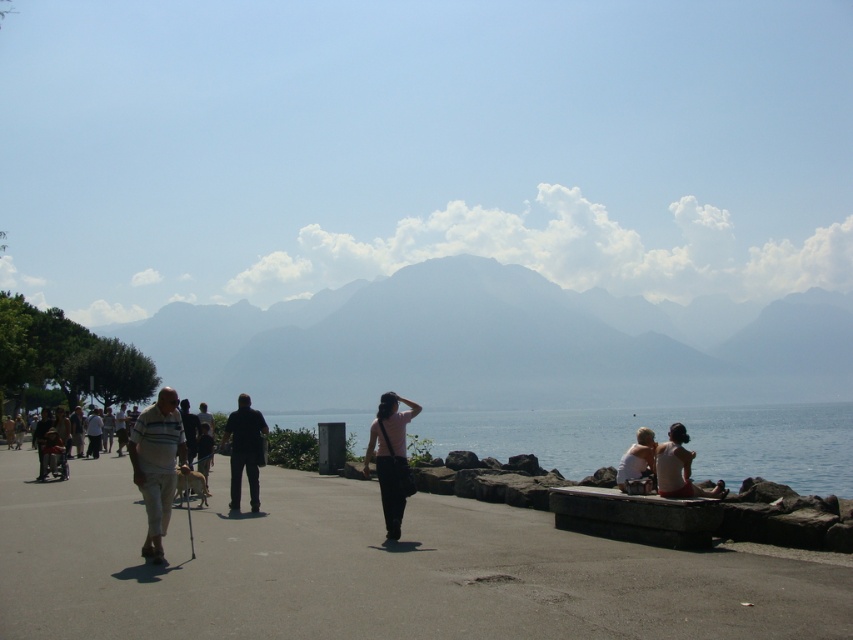
Question: Does concrete sidewalk at center have a smaller size compared to striped cotton shirt at left?

Choices:
 (A) no
 (B) yes

Answer: (A)

Question: Which of the following is the farthest from the observer?

Choices:
 (A) (653, 433)
 (B) (206, 616)

Answer: (A)

Question: Does concrete sidewalk at center appear on the right side of pink fabric shirt at center?

Choices:
 (A) no
 (B) yes

Answer: (A)

Question: Which object appears closest to the camera in this image?

Choices:
 (A) pink fabric shirt at center
 (B) light blue denim shorts at lower right
 (C) gray foggy mountain at center

Answer: (A)

Question: Considering the relative positions of gray foggy mountain at center and light blue denim shorts at lower right in the image provided, where is gray foggy mountain at center located with respect to light blue denim shorts at lower right?

Choices:
 (A) left
 (B) right

Answer: (B)

Question: Among these points, which one is farthest from the camera?

Choices:
 (A) (537, 563)
 (B) (380, 417)
 (C) (676, 449)
 (D) (238, 454)

Answer: (D)